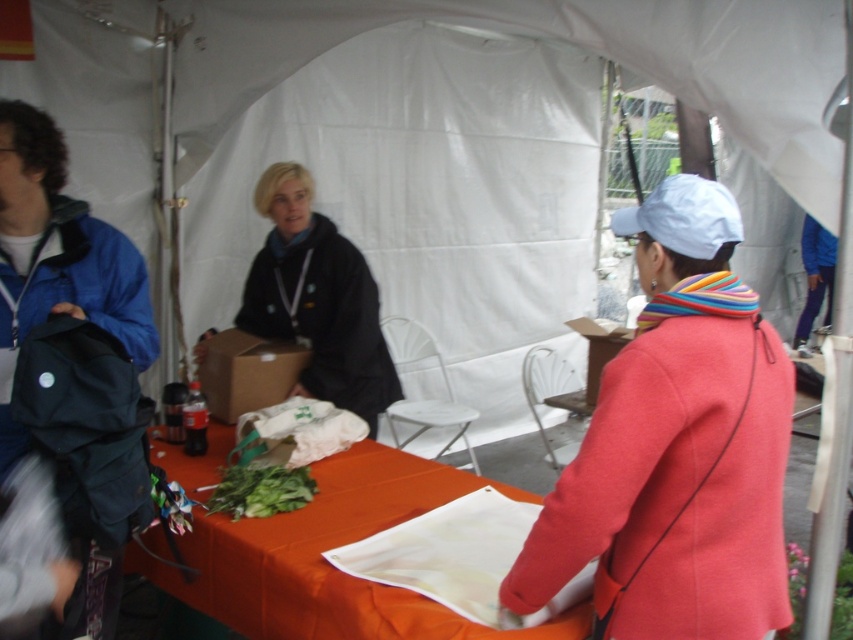
Is black matte jacket at center below white matte cloth at center?

No, black matte jacket at center is not below white matte cloth at center.

Who is shorter, black matte jacket at center or white matte cloth at center?

white matte cloth at center is shorter.

Does point (294, 241) lie in front of point (395, 550)?

No, it is behind (395, 550).

Identify the location of black matte jacket at center. (317, 300).

What do you see at coordinates (317, 300) in the screenshot?
I see `black matte jacket at center` at bounding box center [317, 300].

What do you see at coordinates (317, 300) in the screenshot? Image resolution: width=853 pixels, height=640 pixels. I see `black matte jacket at center` at bounding box center [317, 300].

What are the coordinates of `black matte jacket at center` in the screenshot? It's located at (317, 300).

Which is above, matte coral coat at right or orange fabric table at center?

matte coral coat at right is above.

Is matte coral coat at right wider than orange fabric table at center?

No, matte coral coat at right is not wider than orange fabric table at center.

Which is in front, point (699, 611) or point (207, 540)?

Positioned in front is point (699, 611).

Find the location of a particular element. matte coral coat at right is located at coordinates (676, 448).